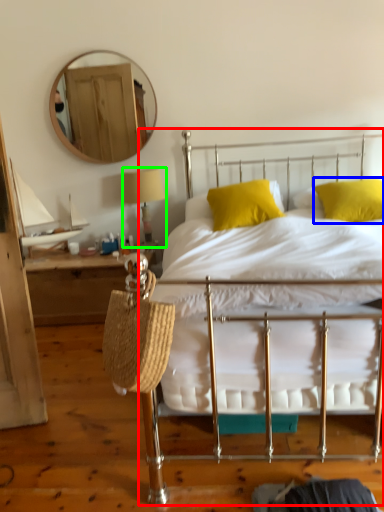
Question: Based on their relative distances, which object is nearer to bed (highlighted by a red box)? Choose from pillow (highlighted by a blue box) and table lamp (highlighted by a green box).

Choices:
 (A) pillow
 (B) table lamp

Answer: (A)